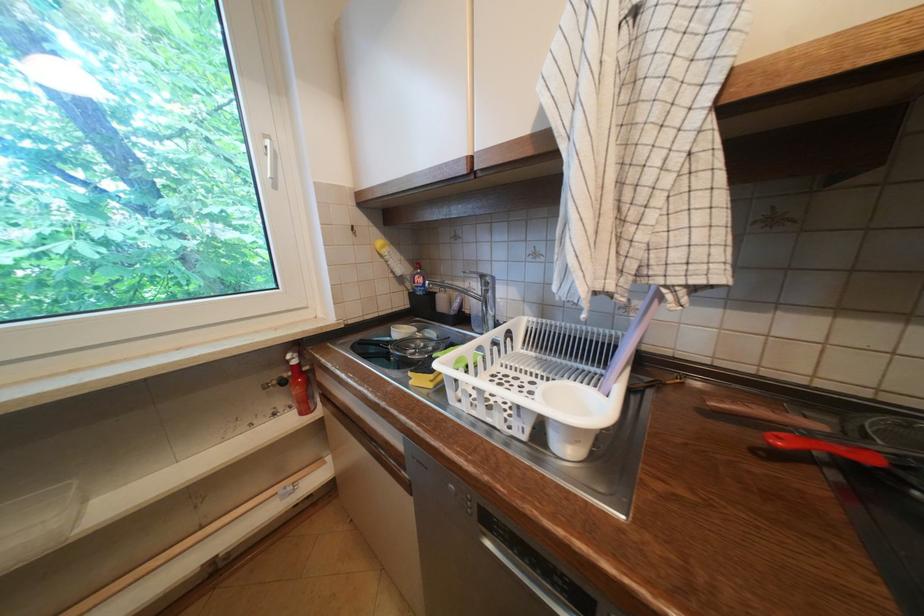
Locate an element on the screen. This screenshot has height=616, width=924. red utensil handle is located at coordinates (853, 448).